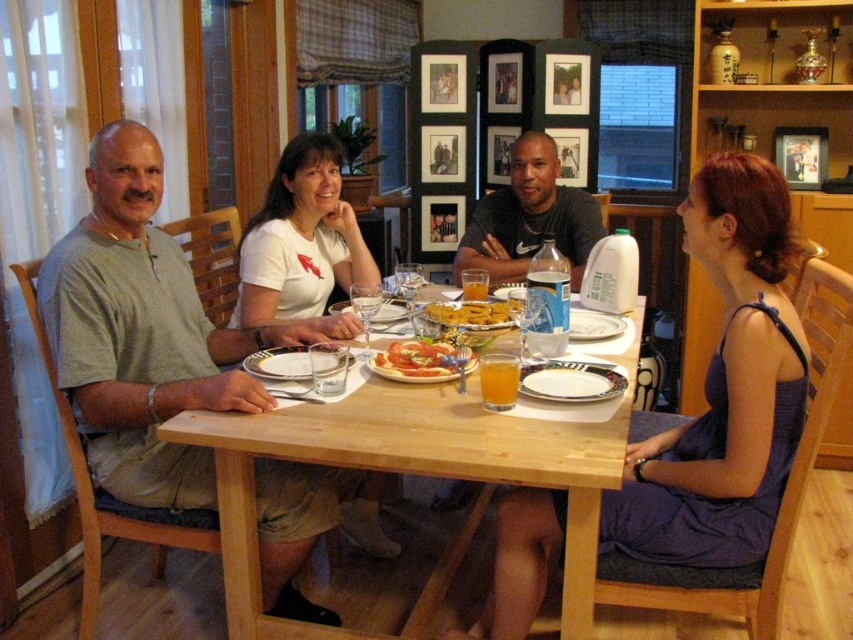
Based on the photo, between purple satin dress at right and white ceramic plate at center, which one is positioned higher?

white ceramic plate at center is above.

Between purple satin dress at right and white ceramic plate at center, which one has less height?

white ceramic plate at center

Find the location of a particular element. The width and height of the screenshot is (853, 640). purple satin dress at right is located at coordinates (724, 388).

Who is lower down, light brown wooden table at center or yellow crispy fries at center?

light brown wooden table at center is lower down.

Does light brown wooden table at center appear under yellow crispy fries at center?

Indeed, light brown wooden table at center is positioned under yellow crispy fries at center.

What do you see at coordinates (415, 474) in the screenshot? The height and width of the screenshot is (640, 853). I see `light brown wooden table at center` at bounding box center [415, 474].

Identify the location of light brown wooden table at center. The image size is (853, 640). (415, 474).

Which is in front, point (306, 628) or point (422, 360)?

Point (306, 628)

What do you see at coordinates (415, 474) in the screenshot?
I see `light brown wooden table at center` at bounding box center [415, 474].

The height and width of the screenshot is (640, 853). Find the location of `light brown wooden table at center`. light brown wooden table at center is located at coordinates (415, 474).